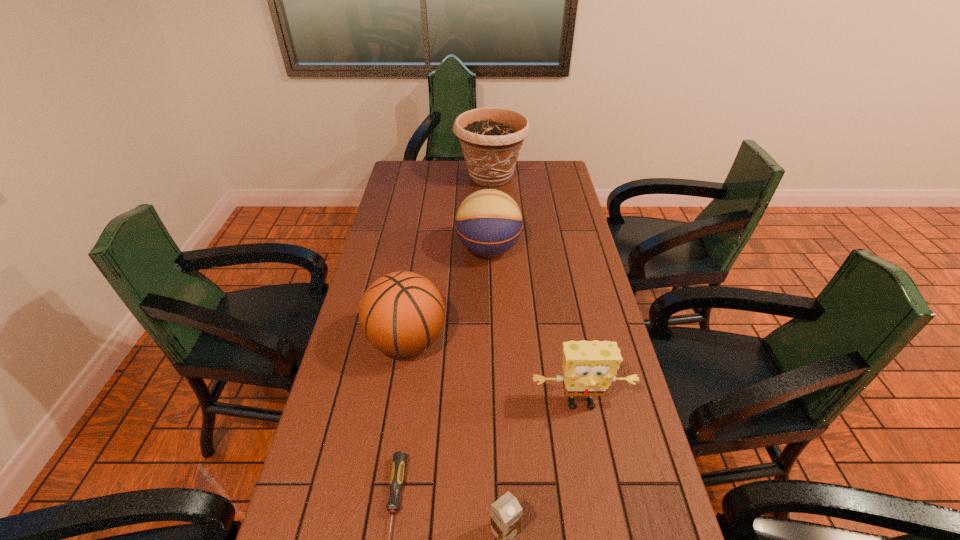
Identify the location of vacant space that's between the right basketball and the fourth farthest object. The height and width of the screenshot is (540, 960). (535, 326).

Find the location of a particular element. This screenshot has width=960, height=540. vacant space that is in between the third nearest object and the flowerpot is located at coordinates (536, 290).

Locate an element on the screen. free space between the nearer basketball and the third nearest object is located at coordinates (493, 372).

Locate an element on the screen. vacant area that lies between the sponge and the farther basketball is located at coordinates (535, 326).

The width and height of the screenshot is (960, 540). I want to click on object that ranks as the closest to the farther basketball, so click(x=402, y=313).

Point out which object is positioned as the fifth nearest to the third nearest object. Please provide its 2D coordinates. Your answer should be formatted as a tuple, i.e. [(x, y)], where the tuple contains the x and y coordinates of a point satisfying the conditions above.

[(491, 138)]